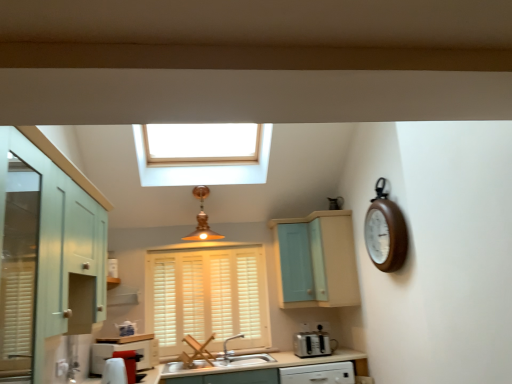
Question: Do you think satin nickel faucet at sink center is within white ceramic sink at center, or outside of it?

Choices:
 (A) outside
 (B) inside

Answer: (A)

Question: In terms of size, does satin nickel faucet at sink center appear bigger or smaller than white ceramic sink at center?

Choices:
 (A) big
 (B) small

Answer: (A)

Question: Estimate the real-world distances between objects in this image. Which object is closer to the copper metallic pendant light at center?

Choices:
 (A) white wood blinds at center
 (B) light blue wood cabinet at center, which is the second cabinetry in left-to-right order
 (C) wooden clock at right
 (D) mint green wood cabinet at left, the 1th cabinetry when ordered from left to right
 (E) light blue wood cabinet at upper center

Answer: (A)

Question: Estimate the real-world distances between objects in this image. Which object is closer to the light blue wood cabinet at center, which is the second cabinetry in left-to-right order?

Choices:
 (A) mint green wood cabinet at left, the first cabinetry positioned from the front
 (B) white wood blinds at center
 (C) white ceramic sink at center
 (D) wooden clock at right
 (E) satin silver toaster at lower center

Answer: (E)